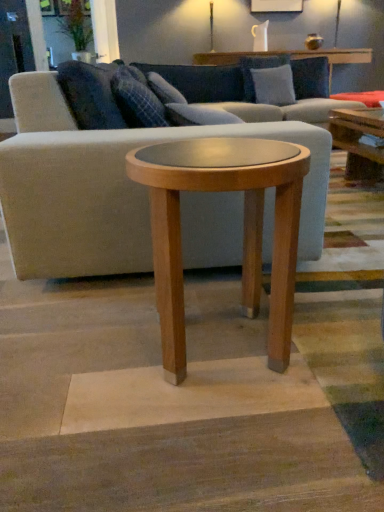
You are a GUI agent. You are given a task and a screenshot of the screen. Output one action in this format:
    pyautogui.click(x=<x>, y=<y>)
    Task: Click on the vacant space underneath light brown wood side table at center (from a real-world perspective)
    
    Given the screenshot: What is the action you would take?
    pyautogui.click(x=221, y=344)